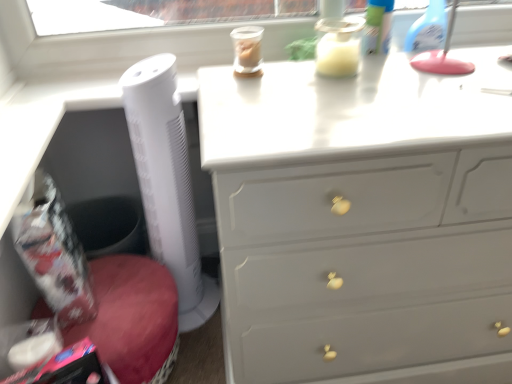
Question: In which direction should I rotate to look at white glossy chest of drawers at upper center?

Choices:
 (A) left
 (B) right

Answer: (B)

Question: Is white plastic tower fan at left to the left of white glossy chest of drawers at upper center from the viewer's perspective?

Choices:
 (A) yes
 (B) no

Answer: (A)

Question: Is white plastic tower fan at left positioned beyond the bounds of white glossy chest of drawers at upper center?

Choices:
 (A) no
 (B) yes

Answer: (B)

Question: Considering the relative sizes of white plastic tower fan at left and white glossy chest of drawers at upper center in the image provided, is white plastic tower fan at left wider than white glossy chest of drawers at upper center?

Choices:
 (A) no
 (B) yes

Answer: (A)

Question: Considering the relative sizes of white plastic tower fan at left and white glossy chest of drawers at upper center in the image provided, is white plastic tower fan at left shorter than white glossy chest of drawers at upper center?

Choices:
 (A) no
 (B) yes

Answer: (A)

Question: Can you confirm if white plastic tower fan at left is smaller than white glossy chest of drawers at upper center?

Choices:
 (A) yes
 (B) no

Answer: (A)

Question: Could white glossy chest of drawers at upper center be considered to be inside white plastic tower fan at left?

Choices:
 (A) no
 (B) yes

Answer: (A)

Question: Is white glossy chest of drawers at upper center directly adjacent to white plastic tower fan at left?

Choices:
 (A) yes
 (B) no

Answer: (B)

Question: Is white glossy chest of drawers at upper center outside of white plastic tower fan at left?

Choices:
 (A) no
 (B) yes

Answer: (B)

Question: Is white plastic tower fan at left located within white glossy chest of drawers at upper center?

Choices:
 (A) no
 (B) yes

Answer: (A)

Question: From a real-world perspective, is white glossy chest of drawers at upper center located beneath white plastic tower fan at left?

Choices:
 (A) yes
 (B) no

Answer: (A)

Question: Can you confirm if white glossy chest of drawers at upper center is bigger than white plastic tower fan at left?

Choices:
 (A) yes
 (B) no

Answer: (A)

Question: Can you confirm if white glossy chest of drawers at upper center is positioned to the right of white plastic tower fan at left?

Choices:
 (A) no
 (B) yes

Answer: (B)

Question: From the image's perspective, is white plastic tower fan at left above or below white glossy chest of drawers at upper center?

Choices:
 (A) below
 (B) above

Answer: (B)